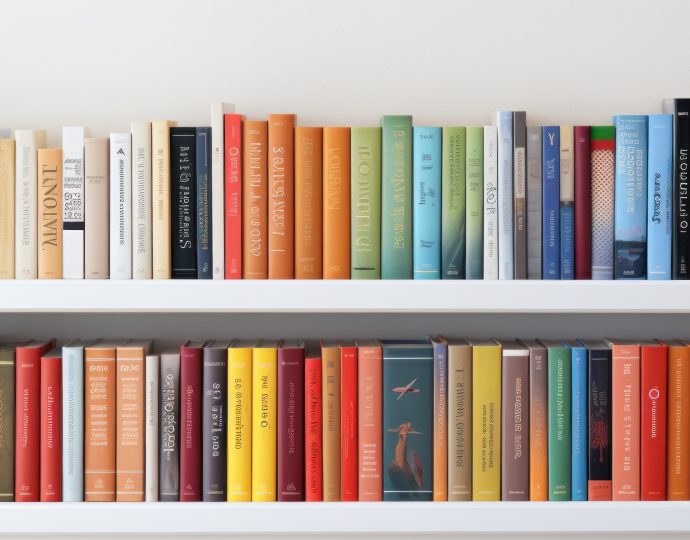
The width and height of the screenshot is (690, 540). Identify the location of white books. (70, 255), (217, 227), (152, 434), (72, 428), (118, 226), (132, 233), (28, 230).